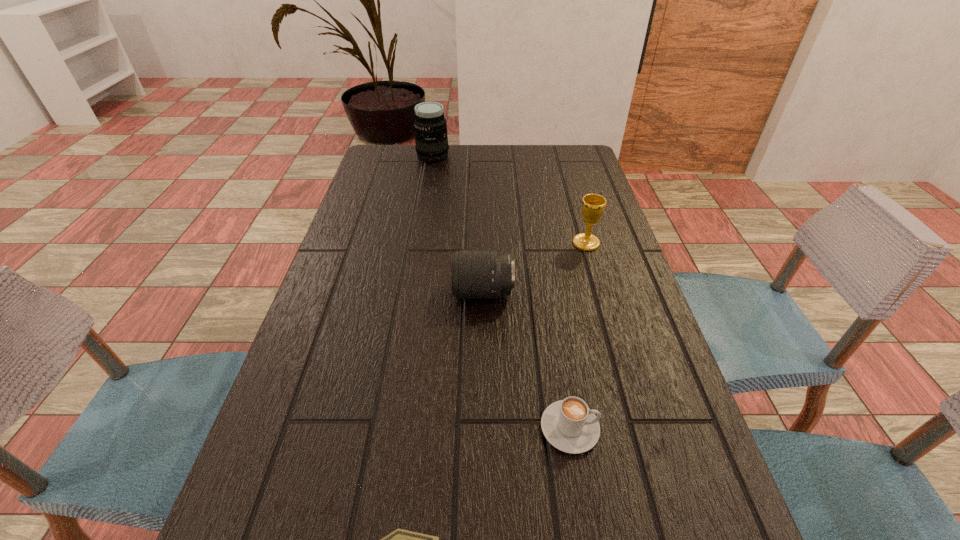
Where is `free space at the left edge of the desktop`? The height and width of the screenshot is (540, 960). free space at the left edge of the desktop is located at coordinates click(x=351, y=237).

The image size is (960, 540). In order to click on free space at the right edge of the desktop in this screenshot , I will do `click(563, 204)`.

Where is `free space between the shorter telephoto lens and the cappuccino`? free space between the shorter telephoto lens and the cappuccino is located at coordinates (526, 360).

This screenshot has height=540, width=960. Find the location of `empty location between the taller telephoto lens and the shorter telephoto lens`. empty location between the taller telephoto lens and the shorter telephoto lens is located at coordinates (458, 224).

This screenshot has height=540, width=960. What are the coordinates of `free space between the shorter telephoto lens and the second tallest object` in the screenshot? It's located at (535, 268).

At what (x,y) coordinates should I click in order to perform the action: click on vacant region between the chalice and the farthest object. Please return your answer as a coordinate pair (x, y). This screenshot has width=960, height=540. Looking at the image, I should click on (510, 199).

Locate an element on the screen. The width and height of the screenshot is (960, 540). blank region between the tallest object and the third nearest object is located at coordinates (458, 224).

You are a GUI agent. You are given a task and a screenshot of the screen. Output one action in this format:
    pyautogui.click(x=<x>, y=<y>)
    Task: Click on the vacant area that lies between the fourth farthest object and the third shortest object
    This screenshot has height=540, width=960.
    Given the screenshot: What is the action you would take?
    pyautogui.click(x=526, y=360)

This screenshot has height=540, width=960. In order to click on the third closest object to the second tallest object in this screenshot , I will do `click(431, 139)`.

Locate which object is the closest to the third tallest object. Please provide its 2D coordinates. Your answer should be formatted as a tuple, i.e. [(x, y)], where the tuple contains the x and y coordinates of a point satisfying the conditions above.

[(593, 205)]